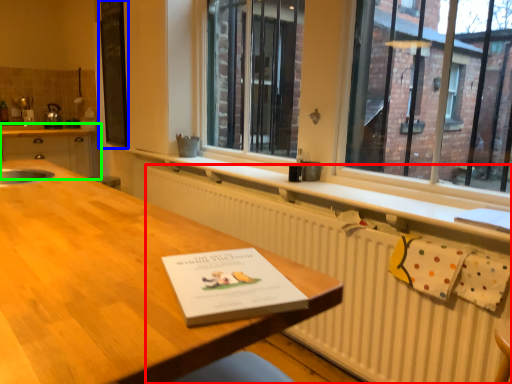
Question: Which object is the closest to the radiator (highlighted by a red box)? Choose among these: bulletin board (highlighted by a blue box) or cabinetry (highlighted by a green box).

Choices:
 (A) bulletin board
 (B) cabinetry

Answer: (A)